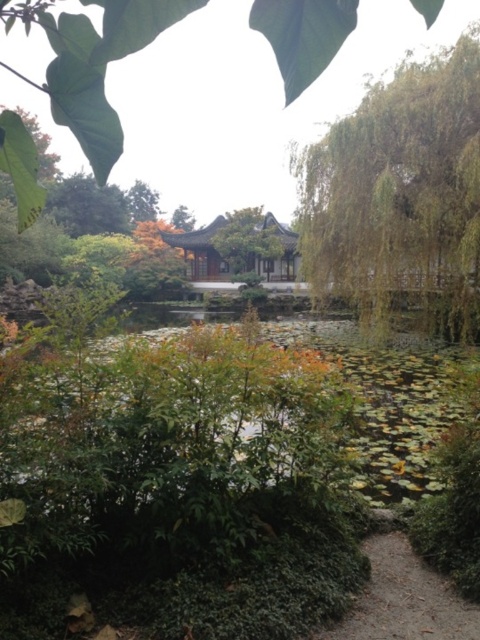
Does green matte tree at center appear under green leafy tree at upper center?

Indeed, green matte tree at center is positioned under green leafy tree at upper center.

Describe the element at coordinates (248, 240) in the screenshot. This screenshot has height=640, width=480. I see `green matte tree at center` at that location.

This screenshot has height=640, width=480. I want to click on green matte tree at center, so click(x=248, y=240).

Which is in front, point (359, 131) or point (261, 220)?

Positioned in front is point (359, 131).

Is green leafy tree at upper right taller than green matte tree at center?

Yes, green leafy tree at upper right is taller than green matte tree at center.

Is point (337, 156) closer to camera compared to point (227, 252)?

Yes.

Where is `green leafy tree at upper right`? green leafy tree at upper right is located at coordinates (400, 193).

Is green leafy tree at upper right in front of green leafy tree at upper center?

Yes, green leafy tree at upper right is closer to the viewer.

You are a GUI agent. You are given a task and a screenshot of the screen. Output one action in this format:
    pyautogui.click(x=<x>, y=<y>)
    Task: Click on the green leafy tree at upper right
    This screenshot has width=480, height=640.
    Given the screenshot: What is the action you would take?
    pyautogui.click(x=400, y=193)

Between point (434, 64) and point (128, 208), which one is positioned in front?

Point (434, 64)

Where is `green leafy tree at upper right`? This screenshot has height=640, width=480. green leafy tree at upper right is located at coordinates (400, 193).